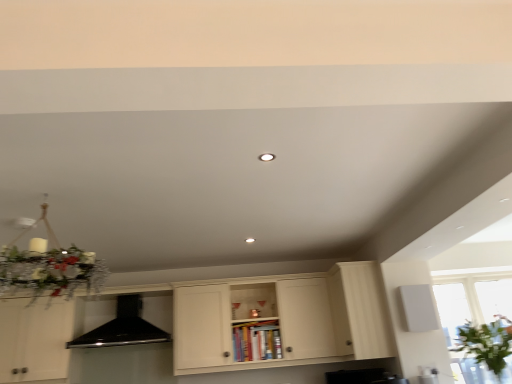
Question: Is white wood cabinet at right, the second cabinetry positioned from the left, positioned with its back to matte white cabinet at center, positioned as the 1th cabinetry in left-to-right order?

Choices:
 (A) yes
 (B) no

Answer: (A)

Question: Could you tell me if white wood cabinet at right, the second cabinetry positioned from the left, is facing matte white cabinet at center, the 2th cabinetry when ordered from right to left?

Choices:
 (A) yes
 (B) no

Answer: (A)

Question: Would you say white wood cabinet at right, positioned as the first cabinetry in right-to-left order, contains matte white cabinet at center, positioned as the 1th cabinetry in left-to-right order?

Choices:
 (A) no
 (B) yes

Answer: (A)

Question: Is white wood cabinet at right, positioned as the first cabinetry in right-to-left order, at the right side of matte white cabinet at center, positioned as the 1th cabinetry in left-to-right order?

Choices:
 (A) no
 (B) yes

Answer: (B)

Question: Can you confirm if white wood cabinet at right, positioned as the first cabinetry in right-to-left order, is wider than matte white cabinet at center, the 2th cabinetry when ordered from right to left?

Choices:
 (A) yes
 (B) no

Answer: (B)

Question: Which is correct: black matte exhaust hood at center is inside matte white cabinet at center, the 2th cabinetry when ordered from right to left, or outside of it?

Choices:
 (A) inside
 (B) outside

Answer: (A)

Question: From the image's perspective, is black matte exhaust hood at center located above or below matte white cabinet at center, positioned as the 1th cabinetry in left-to-right order?

Choices:
 (A) above
 (B) below

Answer: (A)

Question: Is black matte exhaust hood at center to the left or to the right of matte white cabinet at center, the 2th cabinetry when ordered from right to left, in the image?

Choices:
 (A) right
 (B) left

Answer: (B)

Question: Does point (104, 332) appear closer or farther from the camera than point (60, 322)?

Choices:
 (A) closer
 (B) farther

Answer: (B)

Question: From the image's perspective, is white wood cabinet at right, positioned as the first cabinetry in right-to-left order, located above or below matte white cabinet at center, the 2th cabinetry when ordered from right to left?

Choices:
 (A) above
 (B) below

Answer: (A)

Question: Considering the positions of white wood cabinet at right, the second cabinetry positioned from the left, and matte white cabinet at center, the 2th cabinetry when ordered from right to left, in the image, is white wood cabinet at right, the second cabinetry positioned from the left, taller or shorter than matte white cabinet at center, the 2th cabinetry when ordered from right to left,?

Choices:
 (A) short
 (B) tall

Answer: (A)

Question: Does point (351, 309) appear closer or farther from the camera than point (38, 326)?

Choices:
 (A) farther
 (B) closer

Answer: (B)

Question: Do you think white wood cabinet at right, positioned as the first cabinetry in right-to-left order, is within matte white cabinet at center, the 2th cabinetry when ordered from right to left, or outside of it?

Choices:
 (A) outside
 (B) inside

Answer: (B)

Question: From the image's perspective, relative to black matte exhaust hood at center, is matte white cabinet at center, the 2th cabinetry when ordered from right to left, above or below?

Choices:
 (A) below
 (B) above

Answer: (A)

Question: Is matte white cabinet at center, the 2th cabinetry when ordered from right to left, to the left or to the right of black matte exhaust hood at center in the image?

Choices:
 (A) right
 (B) left

Answer: (A)